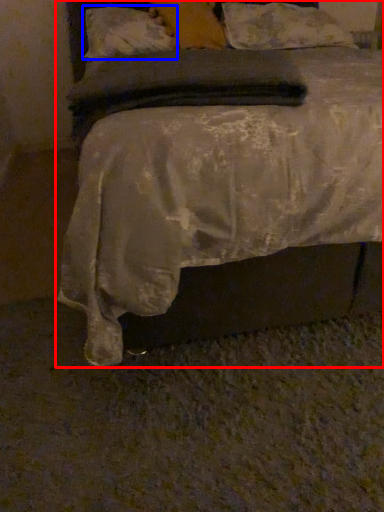
Question: Which object appears farthest to the camera in this image, bed (highlighted by a red box) or pillow (highlighted by a blue box)?

Choices:
 (A) bed
 (B) pillow

Answer: (B)